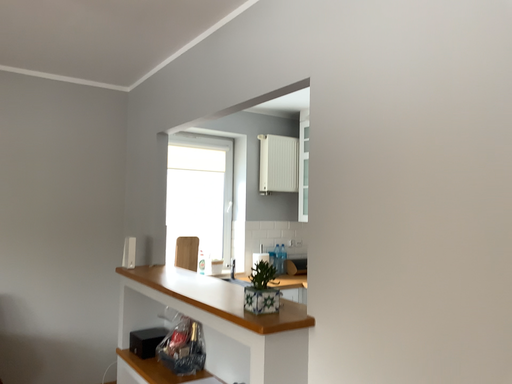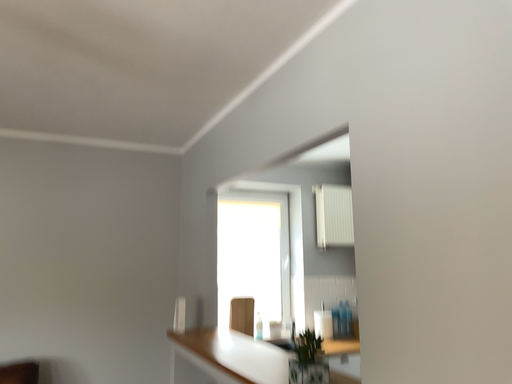
Question: Which way did the camera rotate in the video?

Choices:
 (A) rotated right
 (B) rotated left

Answer: (B)